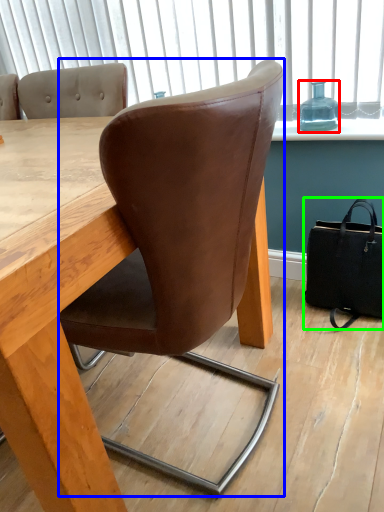
Question: Which is nearer to the bottle (highlighted by a red box)? chair (highlighted by a blue box) or handbag (highlighted by a green box).

Choices:
 (A) chair
 (B) handbag

Answer: (B)